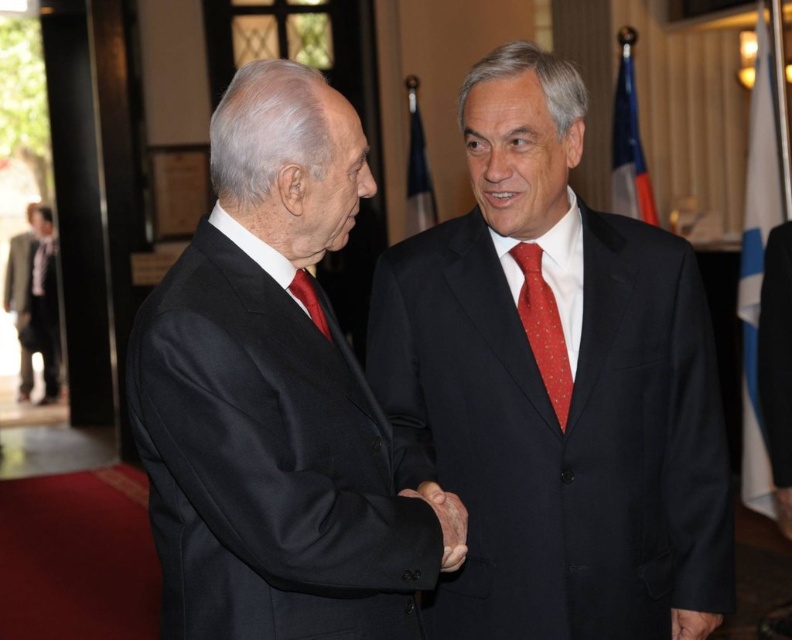
Question: Can you confirm if dark gray wool suit at left is positioned below matte red tie at center?

Choices:
 (A) yes
 (B) no

Answer: (B)

Question: Which point is closer to the camera?

Choices:
 (A) matte black suit at center
 (B) red dotted silk tie at right

Answer: (A)

Question: From the image, what is the correct spatial relationship of black matte suit at center in relation to matte red tie at center?

Choices:
 (A) left
 (B) right

Answer: (A)

Question: Can you confirm if black matte suit at center is positioned to the right of dark gray wool suit at left?

Choices:
 (A) no
 (B) yes

Answer: (B)

Question: Which is farther from the dark gray wool suit at left?

Choices:
 (A) red dotted silk tie at right
 (B) black matte suit at center
 (C) matte red tie at center
 (D) matte black suit at center

Answer: (C)

Question: Among these points, which one is nearest to the camera?

Choices:
 (A) (532, 388)
 (B) (318, 330)
 (C) (227, 189)

Answer: (C)